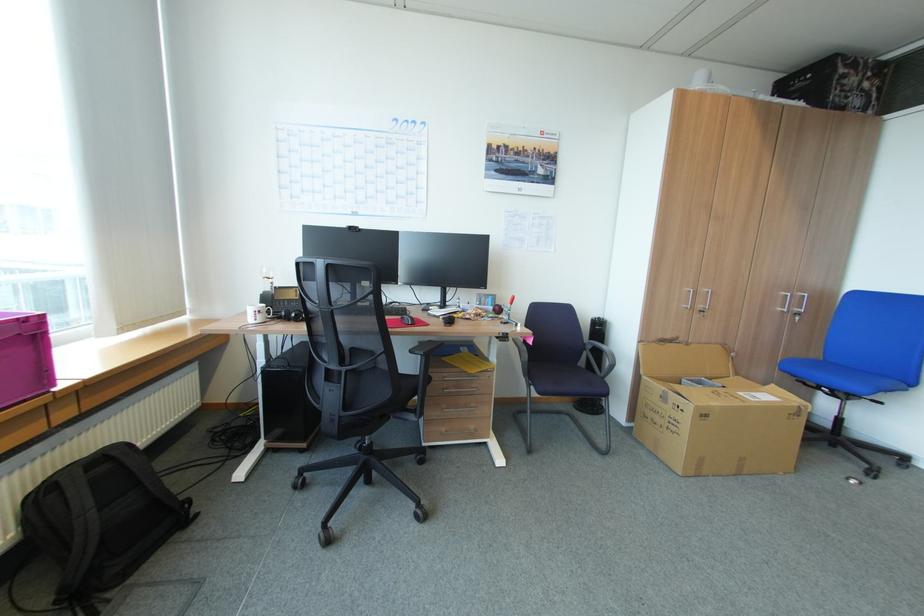
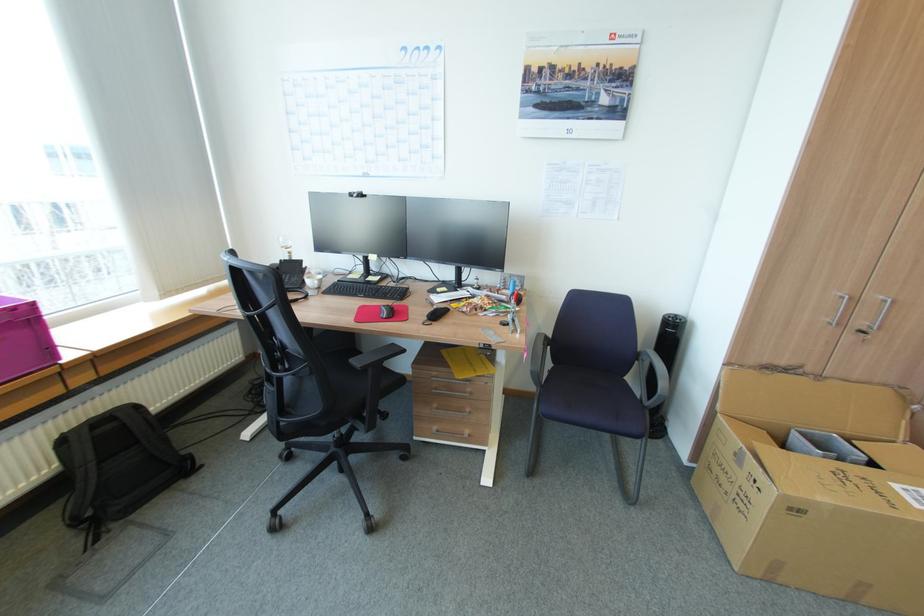
The point at (691, 307) is marked in the first image. Where is the corresponding point in the second image?

(833, 323)